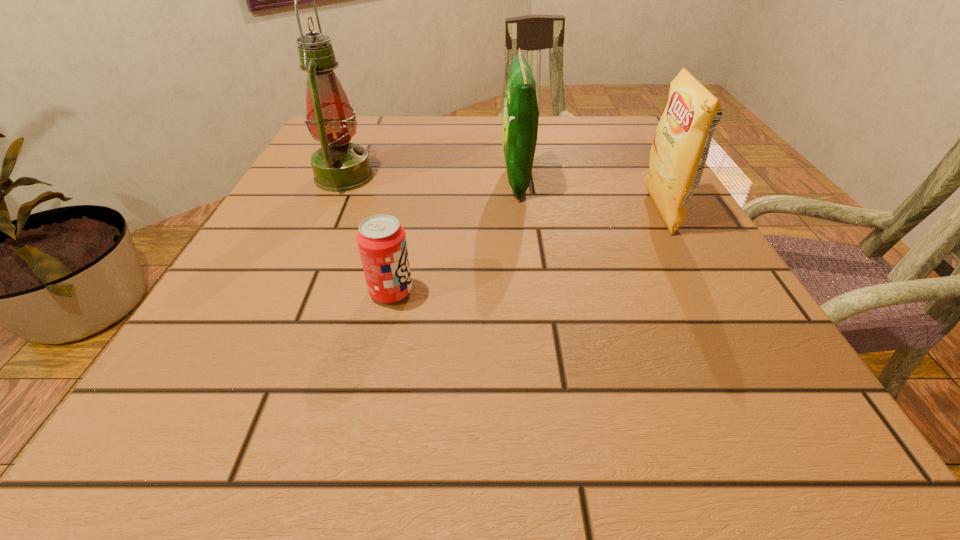
Locate an element on the screen. free spot between the leftmost object and the rightmost object is located at coordinates (502, 195).

Where is `free space between the tallest object and the left crisp (potato chip)`? The image size is (960, 540). free space between the tallest object and the left crisp (potato chip) is located at coordinates (430, 179).

At what (x,y) coordinates should I click in order to perform the action: click on unoccupied area between the third object from left to right and the soda can. Please return your answer as a coordinate pair (x, y). The image size is (960, 540). Looking at the image, I should click on (454, 237).

Where is `free area in between the third object from right to left and the left crisp (potato chip)`? The image size is (960, 540). free area in between the third object from right to left and the left crisp (potato chip) is located at coordinates (454, 237).

Identify which object is the third nearest to the rightmost object. Please provide its 2D coordinates. Your answer should be formatted as a tuple, i.e. [(x, y)], where the tuple contains the x and y coordinates of a point satisfying the conditions above.

[(339, 166)]

Point out which object is positioned as the third nearest to the shortest object. Please provide its 2D coordinates. Your answer should be formatted as a tuple, i.e. [(x, y)], where the tuple contains the x and y coordinates of a point satisfying the conditions above.

[(680, 148)]